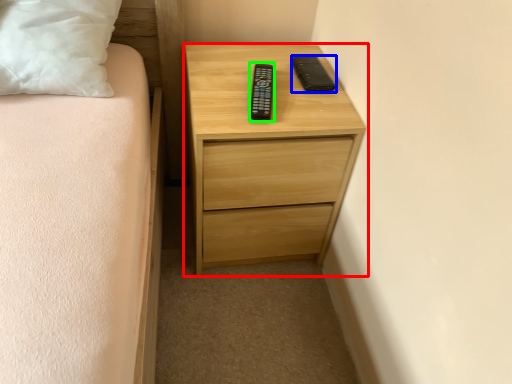
Question: Considering the real-world distances, which object is farthest from chest of drawers (highlighted by a red box)? gadget (highlighted by a blue box) or control (highlighted by a green box)?

Choices:
 (A) gadget
 (B) control

Answer: (A)